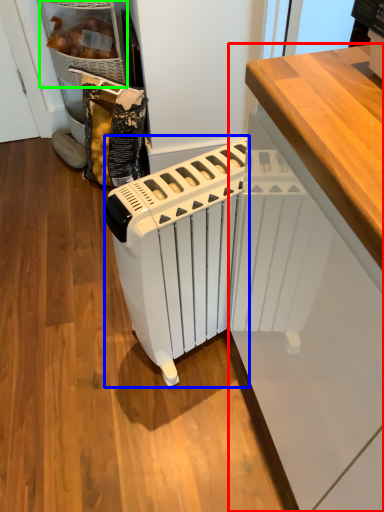
Question: Which object is the closest to the cabinetry (highlighted by a red box)? Choose among these: home appliance (highlighted by a blue box) or cabinetry (highlighted by a green box).

Choices:
 (A) home appliance
 (B) cabinetry

Answer: (A)